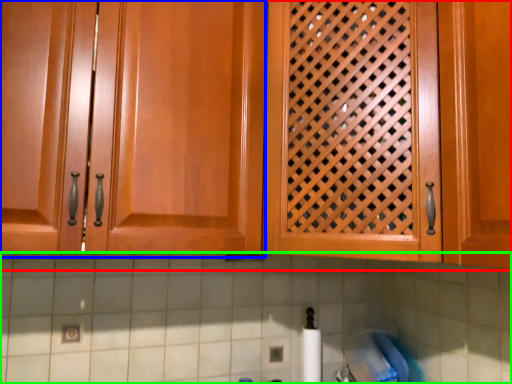
Question: Considering the real-world distances, which object is farthest from cabinetry (highlighted by a red box)? cabinetry (highlighted by a blue box) or granite (highlighted by a green box)?

Choices:
 (A) cabinetry
 (B) granite

Answer: (B)